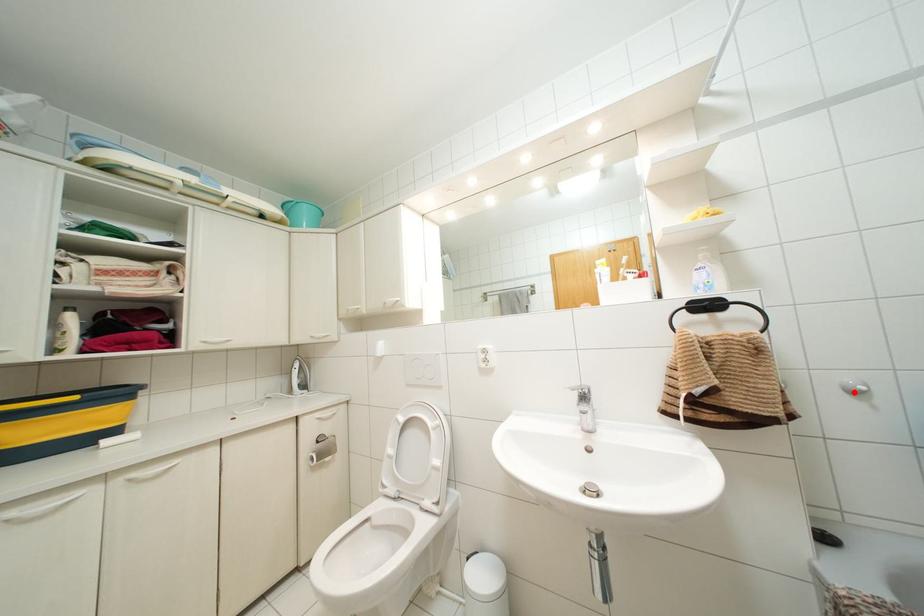
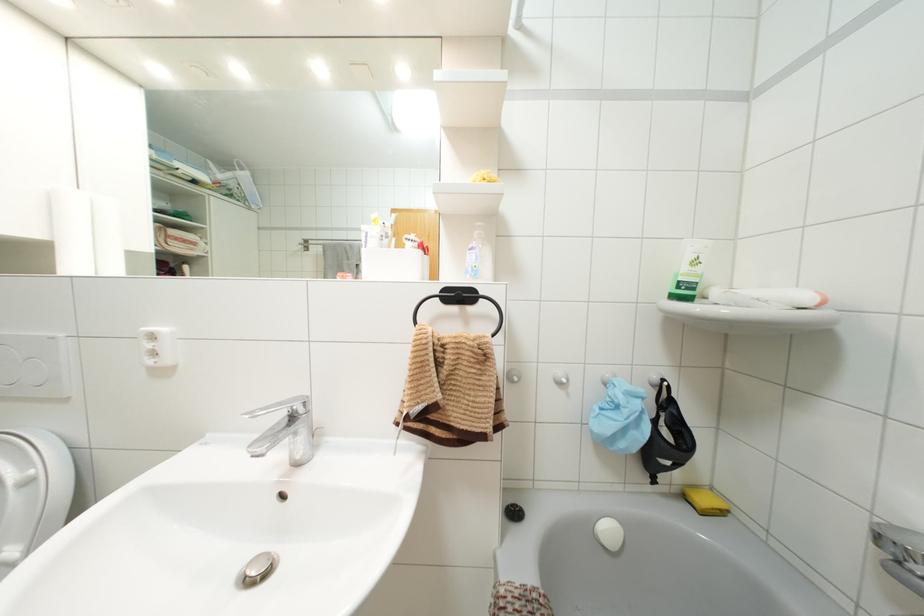
Find the pixel in the second image that matches the highlighted location in the first image.

(558, 383)